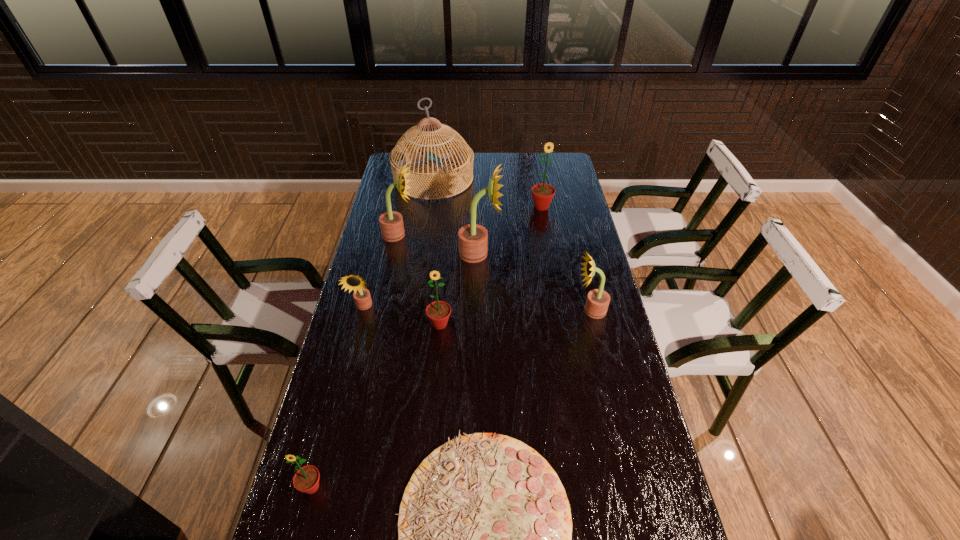
The image size is (960, 540). I want to click on unoccupied area between the rightmost yellow sunflower and the smallest yellow sunflower, so tap(477, 309).

Where is `vacant point located between the rightmost sunflower and the smallest yellow sunflower`? The width and height of the screenshot is (960, 540). vacant point located between the rightmost sunflower and the smallest yellow sunflower is located at coordinates (477, 309).

The width and height of the screenshot is (960, 540). In order to click on unoccupied area between the biggest yellow sunflower and the second biggest yellow sunflower in this screenshot , I will do `click(439, 244)`.

Where is `vacant region between the second biggest yellow sunflower and the third yellow sunflower from left to right`? This screenshot has width=960, height=540. vacant region between the second biggest yellow sunflower and the third yellow sunflower from left to right is located at coordinates (439, 244).

At what (x,y) coordinates should I click in order to perform the action: click on free space that is in between the smallest yellow sunflower and the biggest green sunflower. Please return your answer as a coordinate pair (x, y). Looking at the image, I should click on [452, 257].

Find the location of `blank region between the rightmost sunflower and the birdcage`. blank region between the rightmost sunflower and the birdcage is located at coordinates (512, 245).

This screenshot has height=540, width=960. What are the coordinates of `free area in between the third smallest yellow sunflower and the rightmost sunflower` in the screenshot? It's located at (494, 273).

Where is `empty location between the second object from right to left and the rightmost yellow sunflower`? This screenshot has height=540, width=960. empty location between the second object from right to left and the rightmost yellow sunflower is located at coordinates (566, 259).

Where is `free space between the smallest yellow sunflower and the second smallest green sunflower`? free space between the smallest yellow sunflower and the second smallest green sunflower is located at coordinates (401, 315).

At what (x,y) coordinates should I click in order to perform the action: click on object that is the third closest to the pizza. Please return your answer as a coordinate pair (x, y). The image size is (960, 540). Looking at the image, I should click on (598, 300).